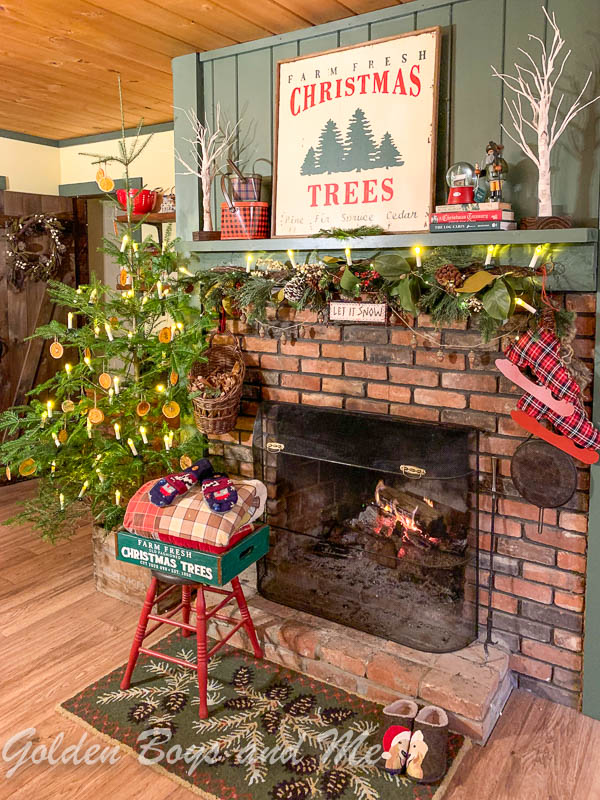
The height and width of the screenshot is (800, 600). I want to click on blanket, so click(x=194, y=506).